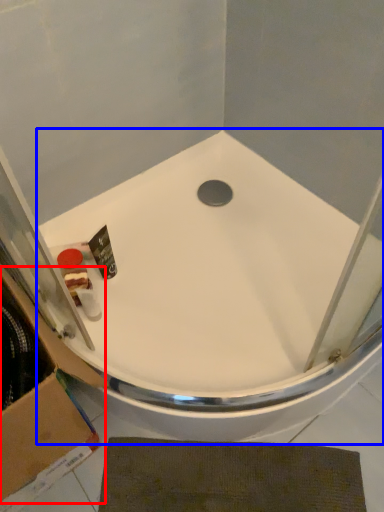
Question: Which object is further to the camera taking this photo, cardboard box (highlighted by a red box) or bathtub (highlighted by a blue box)?

Choices:
 (A) cardboard box
 (B) bathtub

Answer: (B)